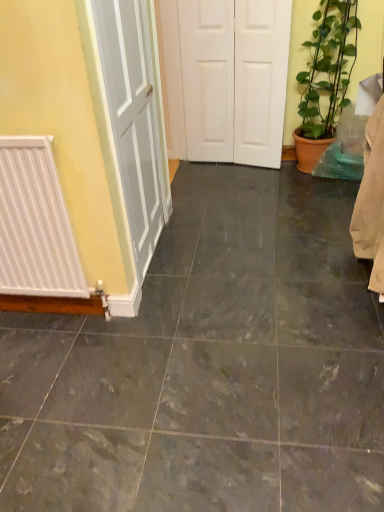
Locate an element on the screen. This screenshot has height=512, width=384. unoccupied region to the right of white matte radiator at left is located at coordinates (124, 332).